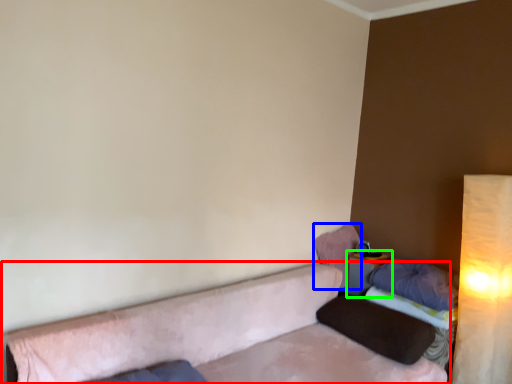
Question: Which object is positioned farthest from studio couch (highlighted by a red box)? Select from pillow (highlighted by a blue box) and table (highlighted by a green box).

Choices:
 (A) pillow
 (B) table

Answer: (B)